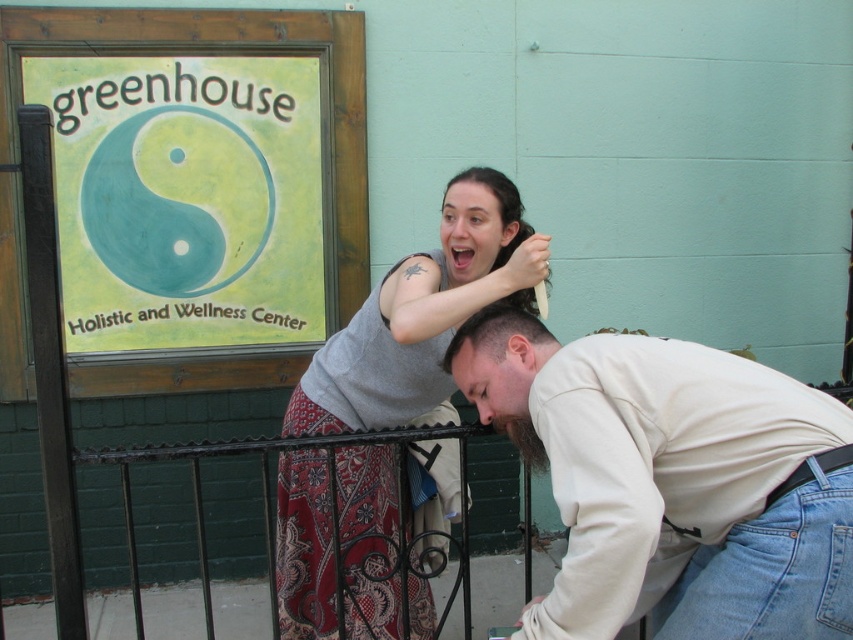
Question: Which of the following is the farthest from the observer?

Choices:
 (A) (532, 435)
 (B) (503, 348)
 (C) (329, 552)

Answer: (C)

Question: Does gray fabric shirt at center appear over dark brown hair at upper center?

Choices:
 (A) no
 (B) yes

Answer: (A)

Question: Estimate the real-world distances between objects in this image. Which object is closer to the beige cotton shirt at lower right?

Choices:
 (A) gray fabric shirt at center
 (B) dark brown hair at upper center

Answer: (B)

Question: Can you confirm if beige cotton shirt at lower right is wider than gray fabric shirt at center?

Choices:
 (A) no
 (B) yes

Answer: (B)

Question: Can you confirm if gray fabric shirt at center is positioned to the right of dark brown hair at upper center?

Choices:
 (A) no
 (B) yes

Answer: (A)

Question: Which point is closer to the camera taking this photo?

Choices:
 (A) (490, 337)
 (B) (485, 296)
 (C) (790, 424)

Answer: (C)